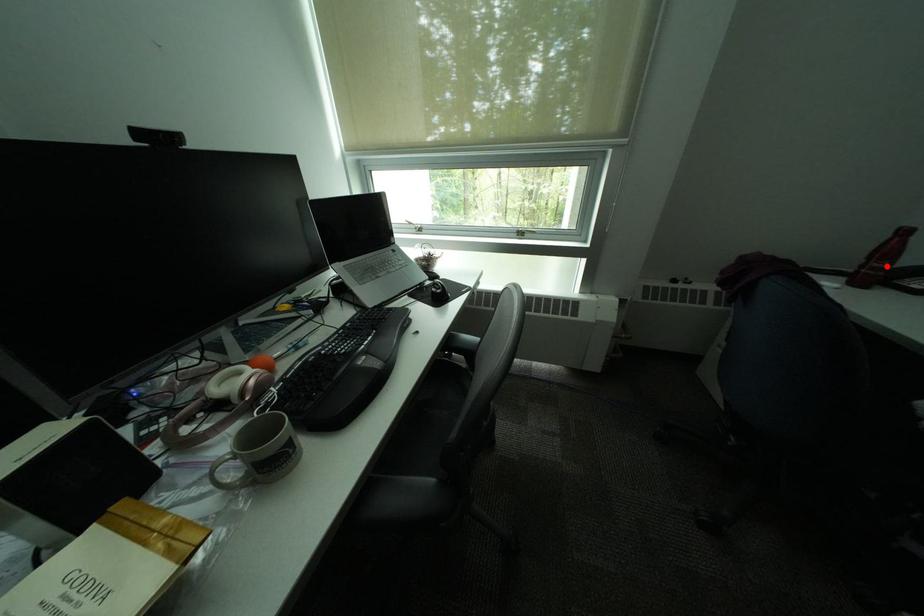
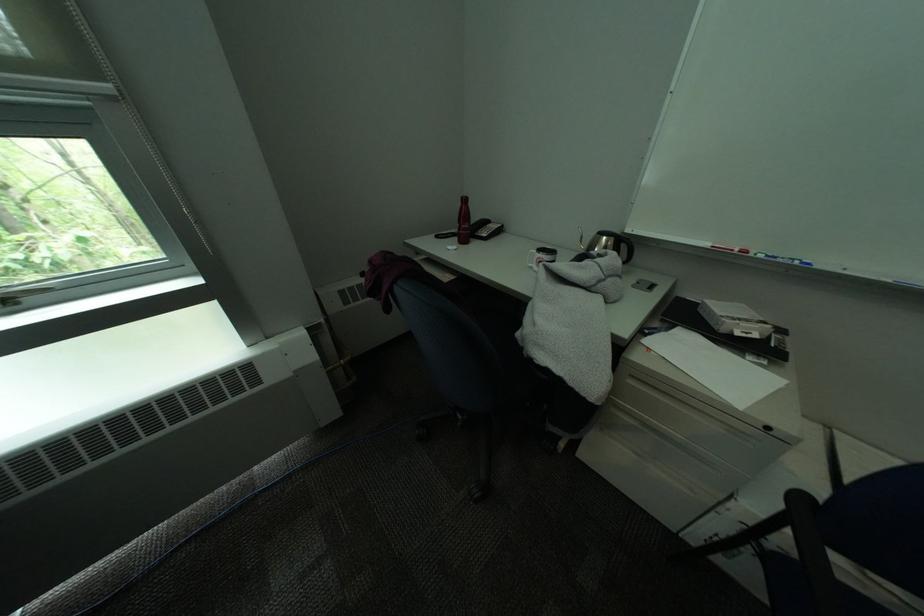
In the second image, find the point that corresponds to the highlighted location in the first image.

(475, 228)